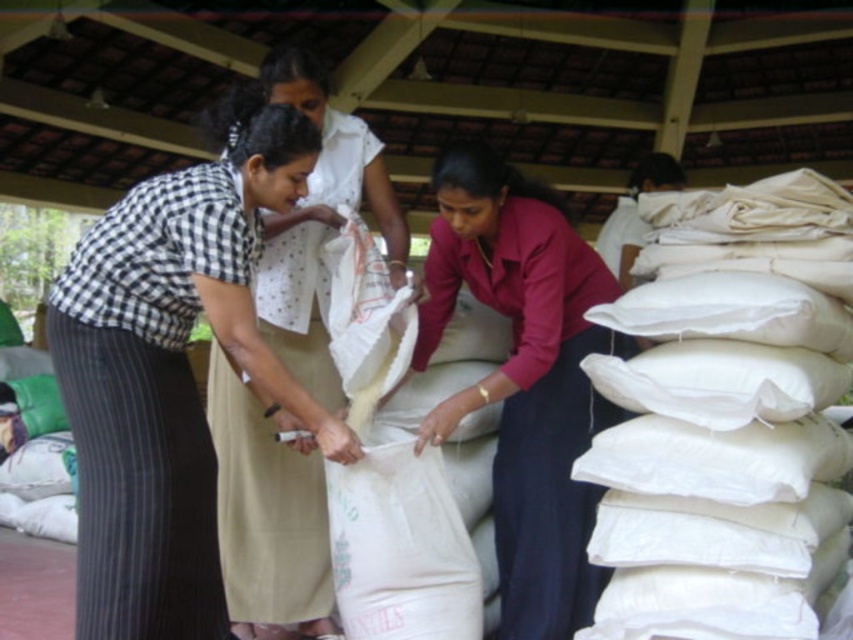
Is point (299, 180) behind point (444, 248)?

No, (299, 180) is closer to viewer.

Who is positioned more to the right, black checkered shirt at left or matte pink shirt at center?

Positioned to the right is matte pink shirt at center.

In the scene shown: Who is more forward, (163, 326) or (578, 548)?

Point (163, 326) is more forward.

The image size is (853, 640). Find the location of `black checkered shirt at left`. black checkered shirt at left is located at coordinates (170, 376).

Which is below, black checkered shirt at left or checkered fabric shirt at center?

black checkered shirt at left is below.

Is point (148, 312) behind point (273, 460)?

No, it is in front of (273, 460).

Where is `black checkered shirt at left`? Image resolution: width=853 pixels, height=640 pixels. black checkered shirt at left is located at coordinates (170, 376).

Measure the distance between point (x=566, y=564) and camera.

The distance of point (x=566, y=564) from camera is 9.61 feet.

Is point (556, 602) behind point (292, 445)?

No, (556, 602) is closer to viewer.

Between point (503, 577) and point (283, 554), which one is positioned behind?

The point (283, 554) is more distant.

Locate an element on the screen. Image resolution: width=853 pixels, height=640 pixels. matte pink shirt at center is located at coordinates (524, 378).